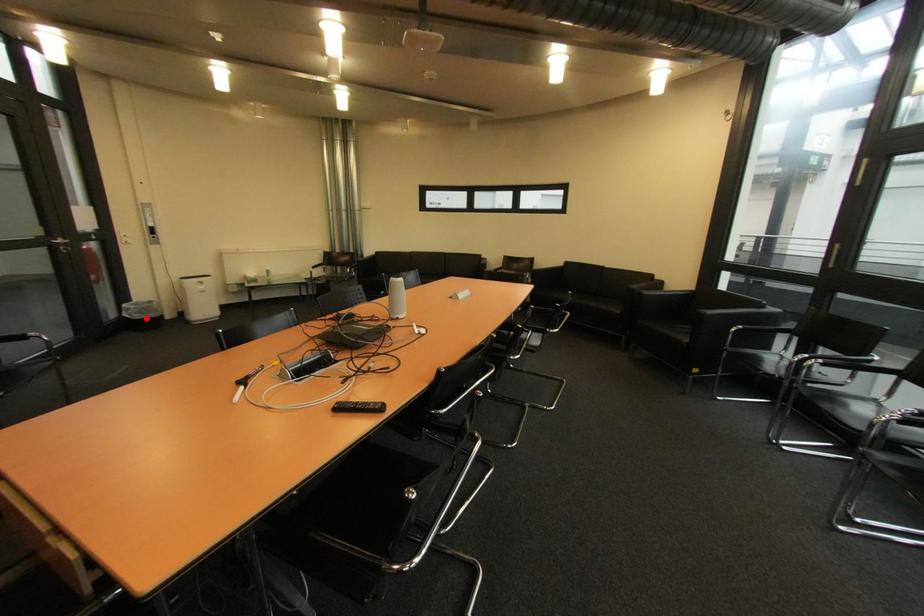
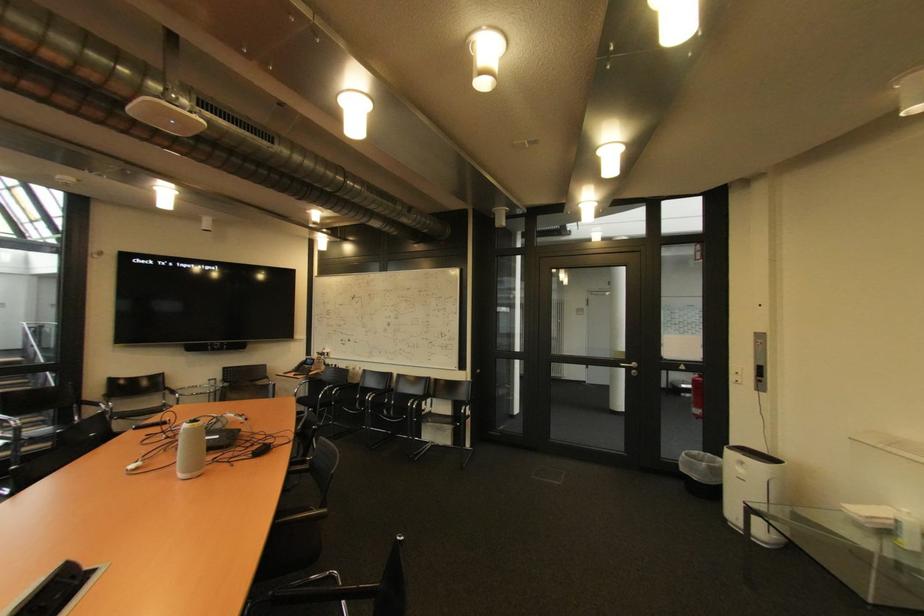
Question: I am providing you with two images of the same scene from different viewpoints. A red point is marked on the first image. Is the red point's position out of view in image 2?

Choices:
 (A) Yes
 (B) No

Answer: (B)